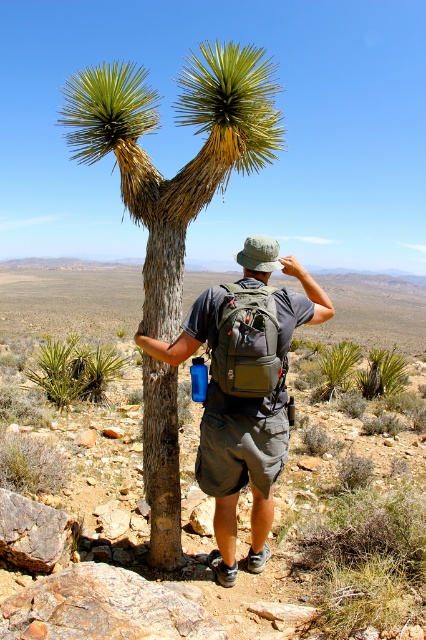
Between green/yellow spiky plant at center and matte green backpack at center, which one appears on the left side from the viewer's perspective?

green/yellow spiky plant at center is more to the left.

This screenshot has height=640, width=426. What do you see at coordinates (186, 163) in the screenshot?
I see `green/yellow spiky plant at center` at bounding box center [186, 163].

The height and width of the screenshot is (640, 426). Describe the element at coordinates (186, 163) in the screenshot. I see `green/yellow spiky plant at center` at that location.

Locate an element on the screen. green/yellow spiky plant at center is located at coordinates (186, 163).

Between matte green backpack at center and green fabric backpack at back, which one is positioned higher?

green fabric backpack at back

Is matte green backpack at center shorter than green fabric backpack at back?

No.

Who is more distant from viewer, (281,333) or (226,349)?

Positioned behind is point (281,333).

This screenshot has height=640, width=426. Find the location of `matte green backpack at center`. matte green backpack at center is located at coordinates (244, 388).

Which is above, green/yellow spiky plant at center or green fabric backpack at back?

green/yellow spiky plant at center

Does point (183, 195) come in front of point (259, 307)?

That is False.

Who is more forward, (181, 200) or (262, 298)?

Point (262, 298) is more forward.

Image resolution: width=426 pixels, height=640 pixels. Identify the location of green/yellow spiky plant at center. (186, 163).